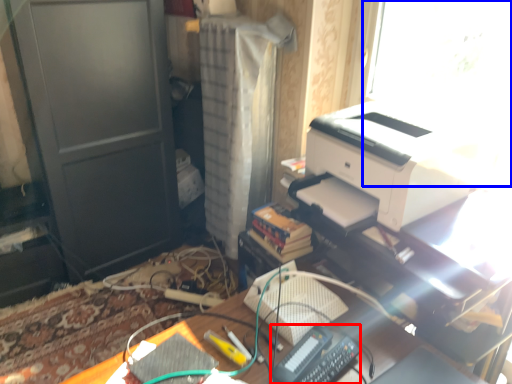
Question: Among these objects, which one is nearest to the camera, equipment (highlighted by a red box) or window screen (highlighted by a blue box)?

Choices:
 (A) equipment
 (B) window screen

Answer: (A)